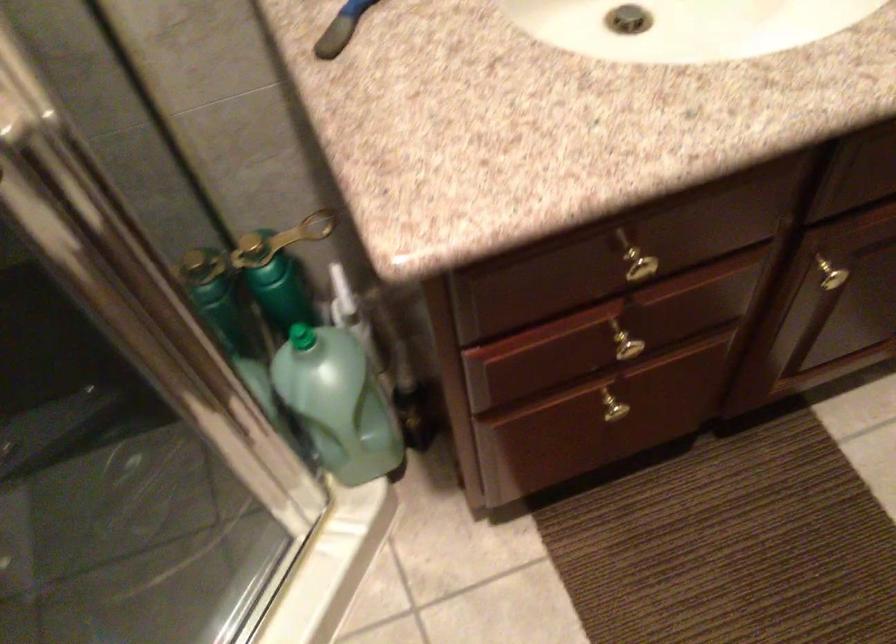
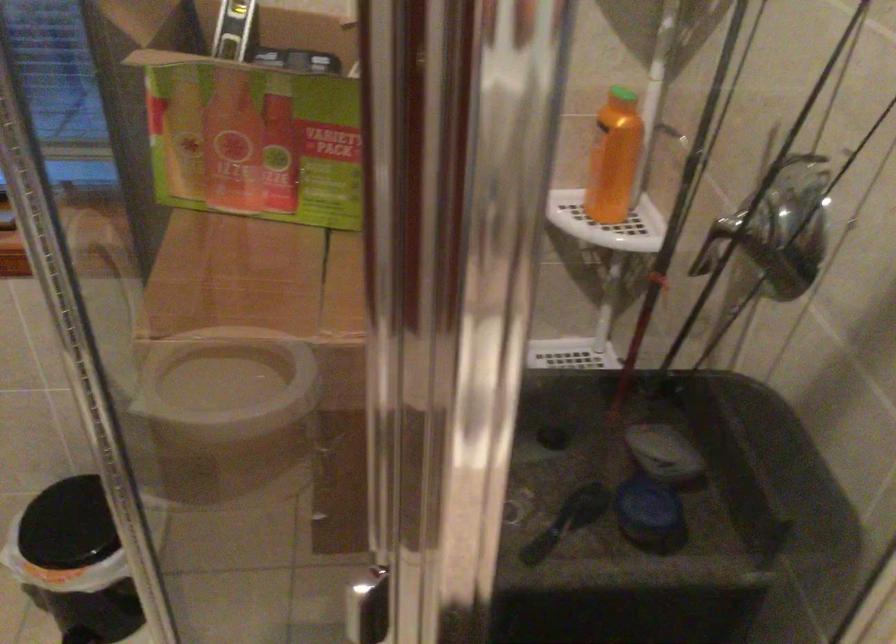
How did the camera likely rotate?

The camera rotated toward left-down.